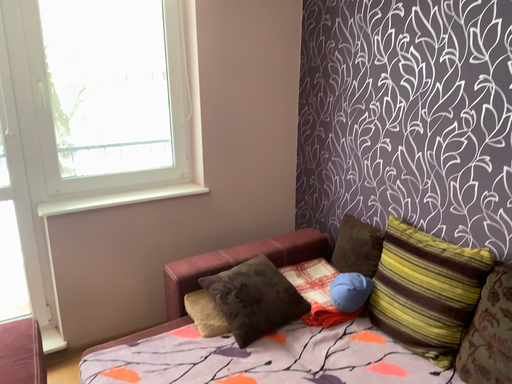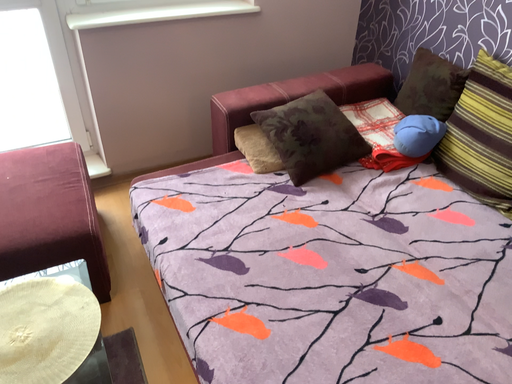
Question: Which way did the camera rotate in the video?

Choices:
 (A) rotated downward
 (B) rotated upward

Answer: (A)